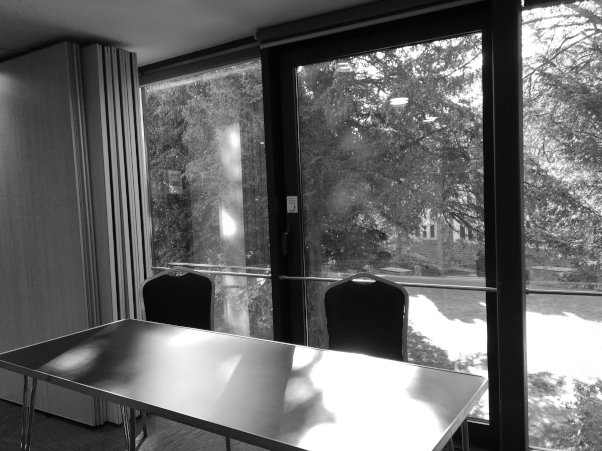
Locate an element on the screen. This screenshot has width=602, height=451. right chair is located at coordinates (379, 313).